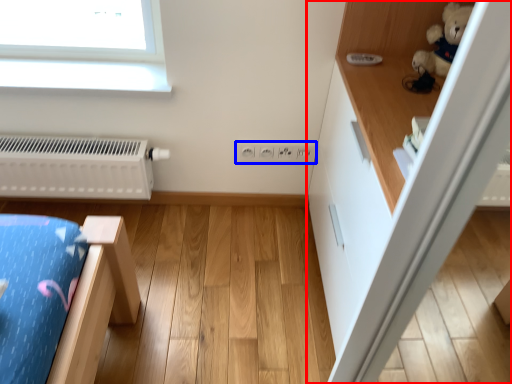
Question: Which point is further to the camera, dresser (highlighted by a red box) or electric outlet (highlighted by a blue box)?

Choices:
 (A) dresser
 (B) electric outlet

Answer: (B)